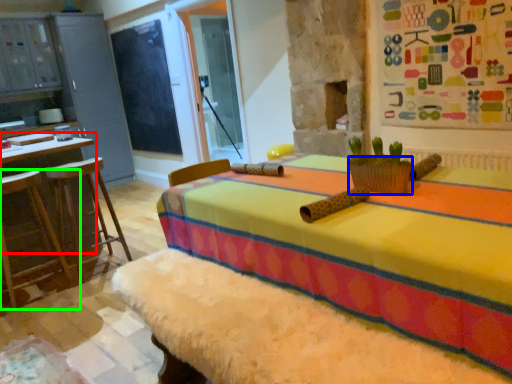
Question: Estimate the real-world distances between objects in this image. Which object is closer to round table (highlighted by a red box), basket (highlighted by a blue box) or furniture (highlighted by a green box)?

Choices:
 (A) basket
 (B) furniture

Answer: (B)